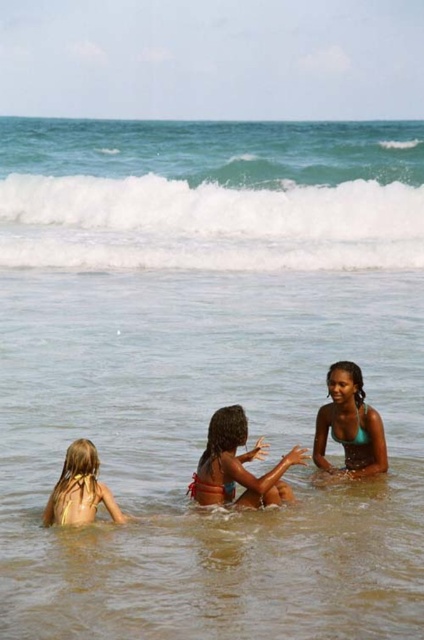
Between point (359, 380) and point (114, 518), which one is positioned in front?

Positioned in front is point (114, 518).

Where is `teal bikini at center`? The width and height of the screenshot is (424, 640). teal bikini at center is located at coordinates (349, 424).

Between point (195, 500) and point (72, 516), which one is positioned in front?

Point (72, 516)

Does point (222, 472) come behind point (92, 499)?

Yes.

Locate an element on the screen. This screenshot has width=424, height=640. red bikini at center is located at coordinates coord(237,465).

Is red bikini at center above teal bikini at center?

Actually, red bikini at center is below teal bikini at center.

Who is more forward, (x=279, y=476) or (x=337, y=396)?

Point (x=279, y=476) is more forward.

Does point (220, 477) lie behind point (382, 445)?

No, (220, 477) is closer to viewer.

I want to click on red bikini at center, so click(x=237, y=465).